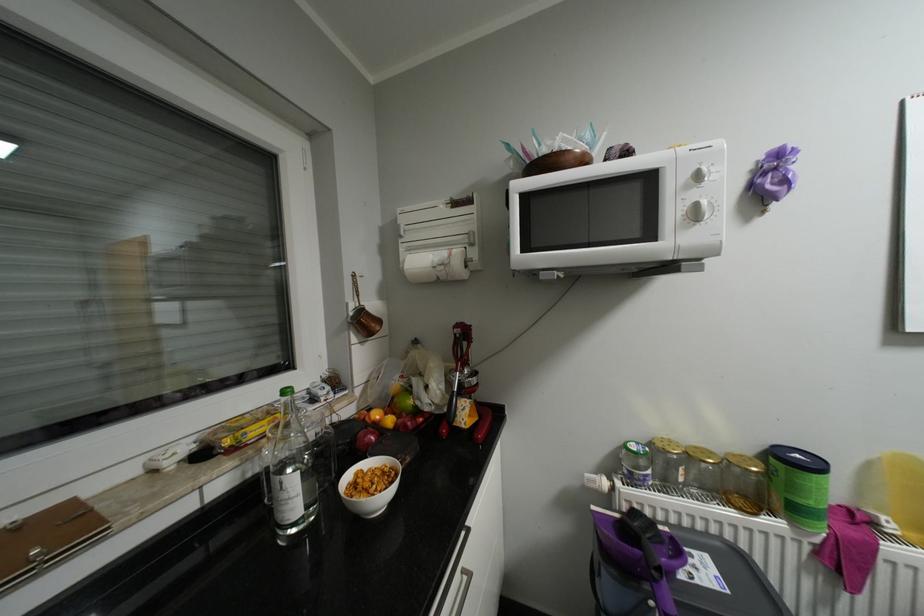
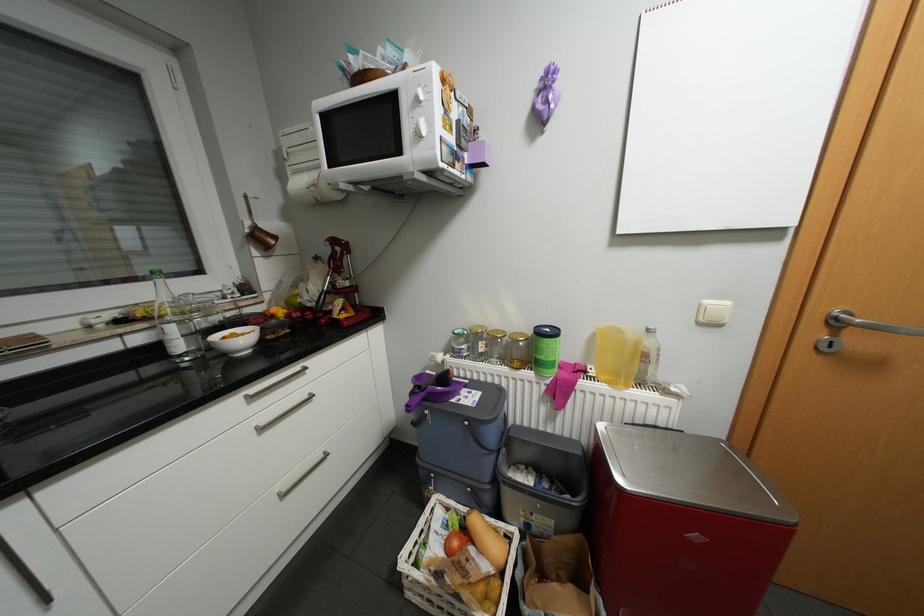
Find the pixel in the second image that matches [658,471] in the first image.

(471, 345)